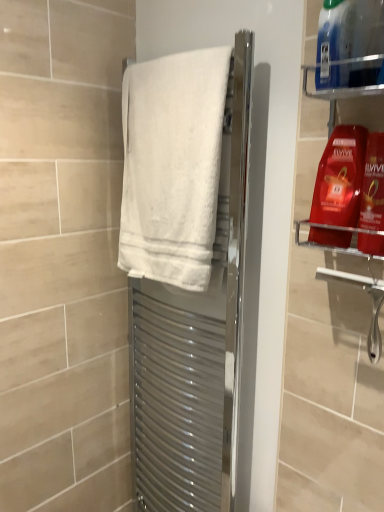
Question: Can you confirm if white cotton towel at center is taller than shiny red plastic shampoo bottle at upper right, placed as the first cleaning product when sorted from bottom to top?

Choices:
 (A) yes
 (B) no

Answer: (A)

Question: From the image's perspective, is white cotton towel at center above shiny red plastic shampoo bottle at upper right, placed as the first cleaning product when sorted from bottom to top?

Choices:
 (A) no
 (B) yes

Answer: (B)

Question: Is white cotton towel at center surrounding shiny red plastic shampoo bottle at upper right, placed as the first cleaning product when sorted from bottom to top?

Choices:
 (A) yes
 (B) no

Answer: (B)

Question: Can you confirm if white cotton towel at center is positioned to the left of shiny red plastic shampoo bottle at upper right, which is counted as the third cleaning product, starting from the top?

Choices:
 (A) yes
 (B) no

Answer: (A)

Question: Is white cotton towel at center facing away from shiny red plastic shampoo bottle at upper right, placed as the first cleaning product when sorted from bottom to top?

Choices:
 (A) yes
 (B) no

Answer: (B)

Question: Does point (x=382, y=200) appear closer or farther from the camera than point (x=342, y=233)?

Choices:
 (A) farther
 (B) closer

Answer: (B)

Question: Choose the correct answer: Is shiny red plastic shampoo bottle at upper right, placed as the first cleaning product when sorted from bottom to top, inside shiny red shampoo at upper right, which appears as the second cleaning product when ordered from the bottom, or outside it?

Choices:
 (A) inside
 (B) outside

Answer: (B)

Question: Is shiny red plastic shampoo bottle at upper right, which is counted as the third cleaning product, starting from the top, wider or thinner than shiny red shampoo at upper right, which appears as the second cleaning product when ordered from the bottom?

Choices:
 (A) wide
 (B) thin

Answer: (B)

Question: Considering the relative positions of shiny red plastic shampoo bottle at upper right, which is counted as the third cleaning product, starting from the top, and shiny red shampoo at upper right, which appears as the second cleaning product when viewed from the top, in the image provided, is shiny red plastic shampoo bottle at upper right, which is counted as the third cleaning product, starting from the top, to the left or to the right of shiny red shampoo at upper right, which appears as the second cleaning product when viewed from the top,?

Choices:
 (A) right
 (B) left

Answer: (A)

Question: Considering their positions, is white fabric towel at center located in front of or behind white cotton towel at center?

Choices:
 (A) front
 (B) behind

Answer: (B)

Question: From their relative heights in the image, would you say white fabric towel at center is taller or shorter than white cotton towel at center?

Choices:
 (A) short
 (B) tall

Answer: (B)

Question: In the image, is white fabric towel at center on the left side or the right side of white cotton towel at center?

Choices:
 (A) right
 (B) left

Answer: (A)

Question: Does point (135, 403) appear closer or farther from the camera than point (175, 95)?

Choices:
 (A) closer
 (B) farther

Answer: (B)

Question: Considering the positions of white cotton towel at center and blue plastic bottle at upper right, marked as the first cleaning product in a top-to-bottom arrangement, in the image, is white cotton towel at center taller or shorter than blue plastic bottle at upper right, marked as the first cleaning product in a top-to-bottom arrangement,?

Choices:
 (A) tall
 (B) short

Answer: (A)

Question: Based on their sizes in the image, would you say white cotton towel at center is bigger or smaller than blue plastic bottle at upper right, marked as the 3th cleaning product in a bottom-to-top arrangement?

Choices:
 (A) small
 (B) big

Answer: (B)